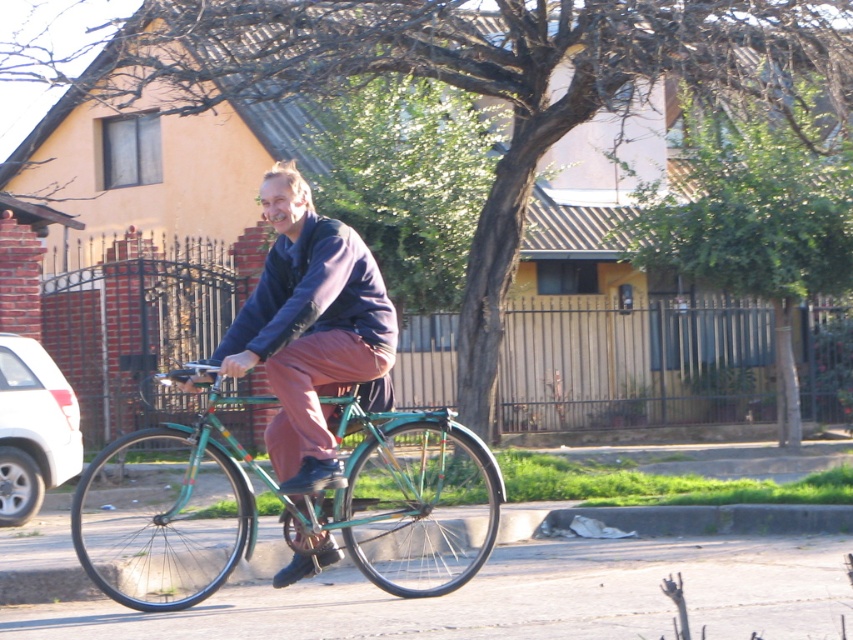
You are a delivery person who needs to carry a large package. You see a green metallic bicycle at center and a dark blue fleece jacket at center. Which object can you use to carry the package?

The green metallic bicycle at center has a larger size compared to the dark blue fleece jacket at center, so you can use the green metallic bicycle at center to carry the package.

From the picture: You are a delivery person who needs to load a box onto the green metallic bicycle at center. The box is 2 feet tall. Can you place the box on top of the dark blue fleece jacket at center without it falling off?

The green metallic bicycle at center is not as tall as the dark blue fleece jacket at center. Since the jacket is taller, the box can be placed on top of it without falling off.

You are a pedestrian standing on the sidewalk and see the green metallic bicycle at center and the dark blue fleece jacket at center. Which object is closer to the left side of the sidewalk?

The green metallic bicycle at center is closer to the left side of the sidewalk because it is positioned to the left of the dark blue fleece jacket at center.